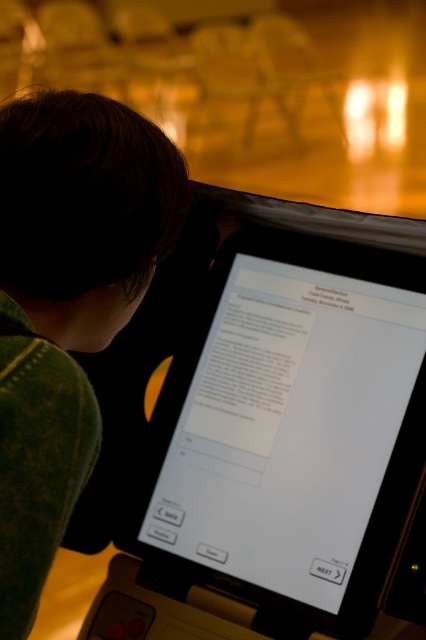
Can you confirm if white glossy screen at center is positioned to the right of green textured sweater at upper left?

Correct, you'll find white glossy screen at center to the right of green textured sweater at upper left.

Is point (256, 243) behind point (81, 278)?

Yes.

This screenshot has height=640, width=426. In order to click on white glossy screen at center in this screenshot , I will do `click(284, 445)`.